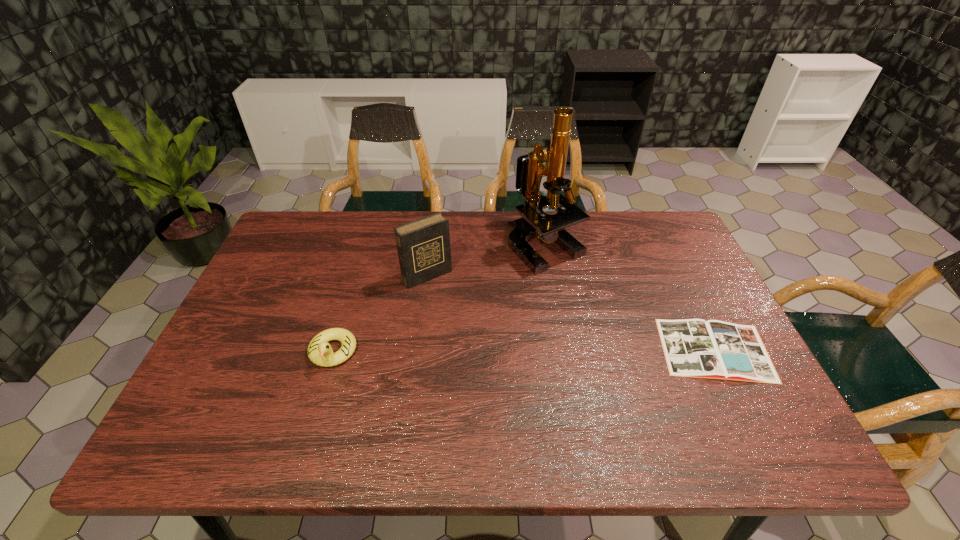
This screenshot has height=540, width=960. I want to click on empty space between the duckling and the second object from right to left, so click(x=439, y=298).

Locate an element on the screen. The image size is (960, 540). vacant space in between the shortest object and the leftmost object is located at coordinates (523, 350).

The image size is (960, 540). I want to click on free space that is in between the second object from right to left and the leftmost object, so click(439, 298).

I want to click on vacant space that is in between the book and the duckling, so click(x=523, y=350).

Identify which object is located as the third nearest to the shortest object. Please provide its 2D coordinates. Your answer should be formatted as a tuple, i.e. [(x, y)], where the tuple contains the x and y coordinates of a point satisfying the conditions above.

[(320, 352)]

Identify which object is the third closest to the rightmost object. Please provide its 2D coordinates. Your answer should be formatted as a tuple, i.e. [(x, y)], where the tuple contains the x and y coordinates of a point satisfying the conditions above.

[(320, 352)]

This screenshot has height=540, width=960. Identify the location of free spot that satisfies the following two spatial constraints: 1. on the back side of the second object from right to left; 2. on the left side of the diary. (431, 245).